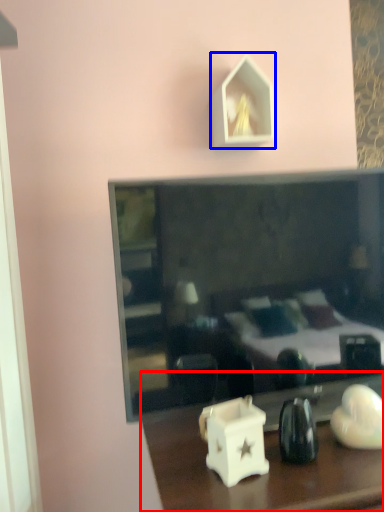
Question: Which object appears closest to the camera in this image, table (highlighted by a red box) or picture frame (highlighted by a blue box)?

Choices:
 (A) table
 (B) picture frame

Answer: (A)